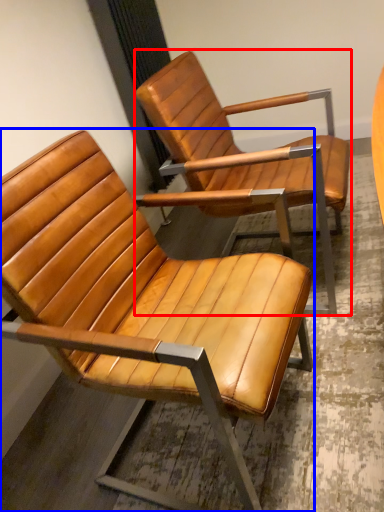
Question: Among these objects, which one is nearest to the camera, chair (highlighted by a red box) or chair (highlighted by a blue box)?

Choices:
 (A) chair
 (B) chair

Answer: (B)